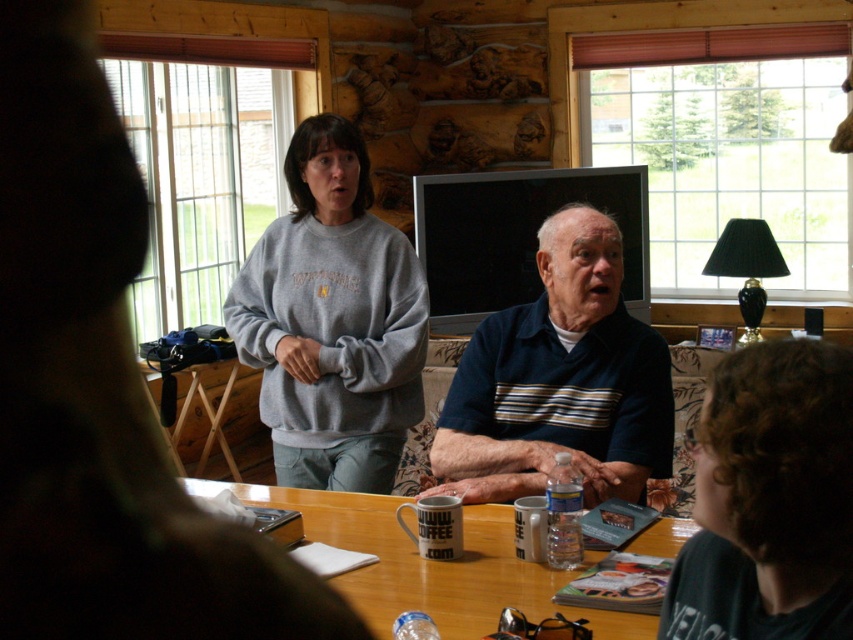
You are trying to decide where to place a new decorative item in the living room. The gray sweatshirt at upper left and the wooden table at center are both in view. Which object takes up more visual space in the image?

The gray sweatshirt at upper left takes up more visual space than the wooden table at center because it is larger in size according to the description.

You are a fashion designer analyzing clothing sizes in the image. Which clothing item, the gray sweatshirt at upper left or the blue striped polo shirt at center, would require less fabric to produce?

The gray sweatshirt at upper left has a smaller size compared to the blue striped polo shirt at center, so it would require less fabric to produce.

You are a photographer setting up a shoot in this living room. You want to place a small prop between the blue striped polo shirt at center and the wooden table at center. Based on their positions, where should you place the prop?

The blue striped polo shirt at center is to the right of the wooden table at center, so you should place the prop in the space between them, which would be to the left of the blue striped polo shirt at center and to the right of the wooden table at center.